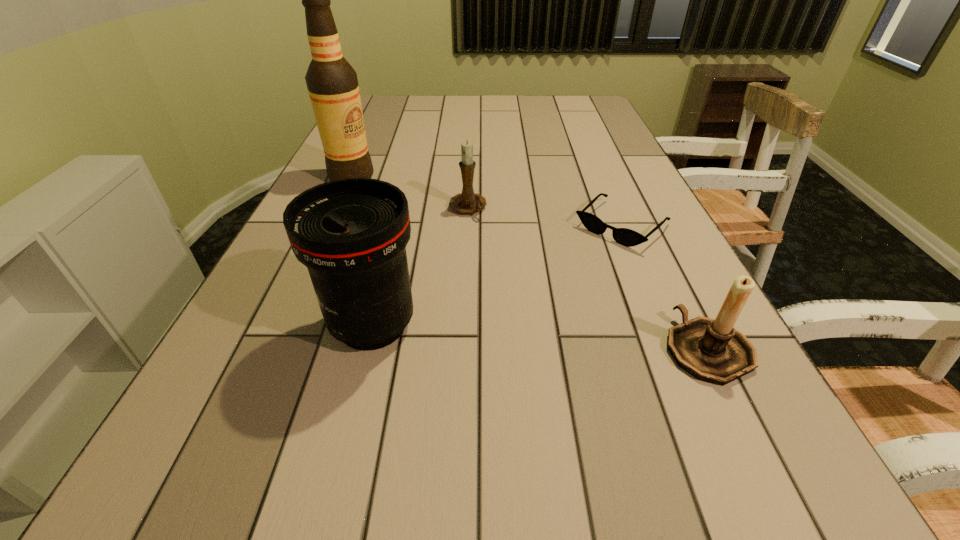
Find the location of a particular element. candle holder that is at the right edge is located at coordinates (711, 350).

Image resolution: width=960 pixels, height=540 pixels. I want to click on sunglasses that is at the right edge, so click(624, 236).

At what (x,y) coordinates should I click in order to perform the action: click on free space at the far edge of the desktop. Please return your answer as a coordinate pair (x, y). The image size is (960, 540). Looking at the image, I should click on (534, 114).

The image size is (960, 540). What are the coordinates of `free space at the left edge` in the screenshot? It's located at (378, 130).

This screenshot has width=960, height=540. In the image, there is a desktop. Find the location of `vacant space at the right edge`. vacant space at the right edge is located at coordinates (593, 145).

In the image, there is a desktop. Identify the location of vacant space at the far left corner. This screenshot has width=960, height=540. coord(373,96).

You are a GUI agent. You are given a task and a screenshot of the screen. Output one action in this format:
    pyautogui.click(x=<x>, y=<y>)
    Task: Click on the free space at the far right corner of the desktop
    The image size is (960, 540).
    Given the screenshot: What is the action you would take?
    pyautogui.click(x=560, y=103)

This screenshot has height=540, width=960. What are the coordinates of `vacant space at the near right corner` in the screenshot? It's located at [x=706, y=415].

Where is `unoccupied position between the third object from right to left and the telephoto lens`? Image resolution: width=960 pixels, height=540 pixels. unoccupied position between the third object from right to left and the telephoto lens is located at coordinates (420, 267).

Find the location of a particular element. This screenshot has width=960, height=540. free space between the shortest object and the nearer candle holder is located at coordinates (664, 287).